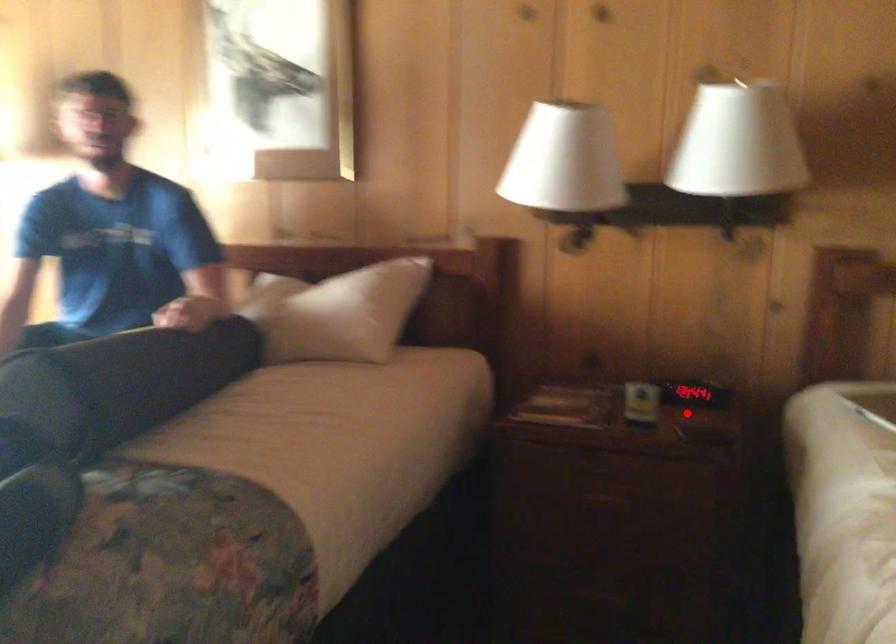
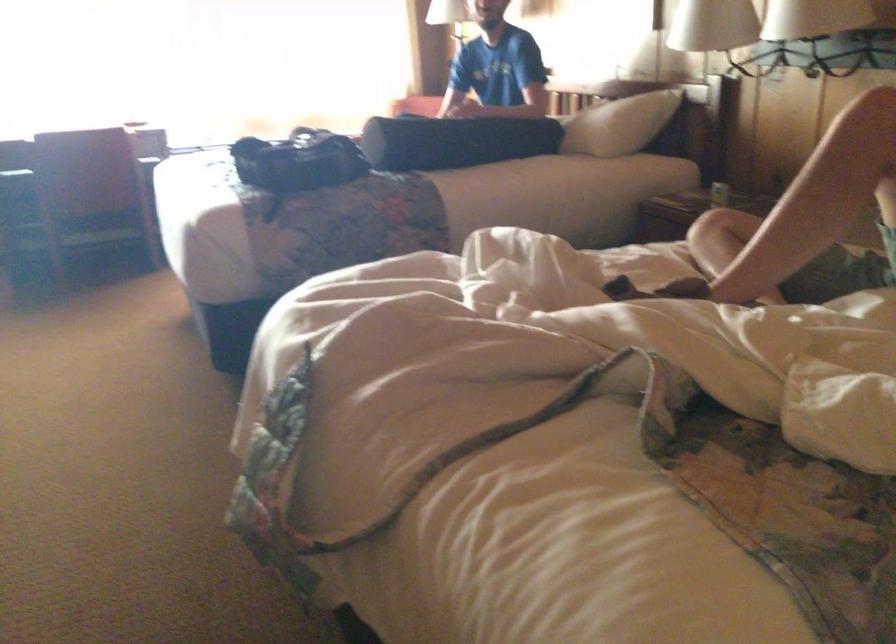
The point at the highlighted location is marked in the first image. Where is the corresponding point in the second image?

(719, 194)